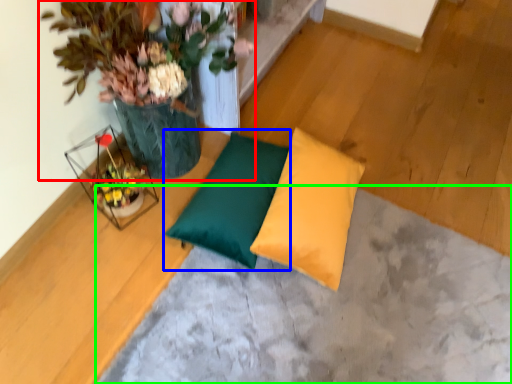
Question: Based on their relative distances, which object is nearer to houseplant (highlighted by a red box)? Choose from pillow (highlighted by a blue box) and concrete (highlighted by a green box).

Choices:
 (A) pillow
 (B) concrete

Answer: (A)